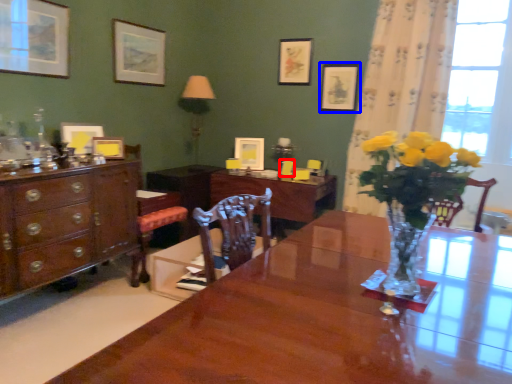
Question: Which of the following is the closest to the observer, armchair (highlighted by a red box) or picture frame (highlighted by a blue box)?

Choices:
 (A) armchair
 (B) picture frame

Answer: (B)